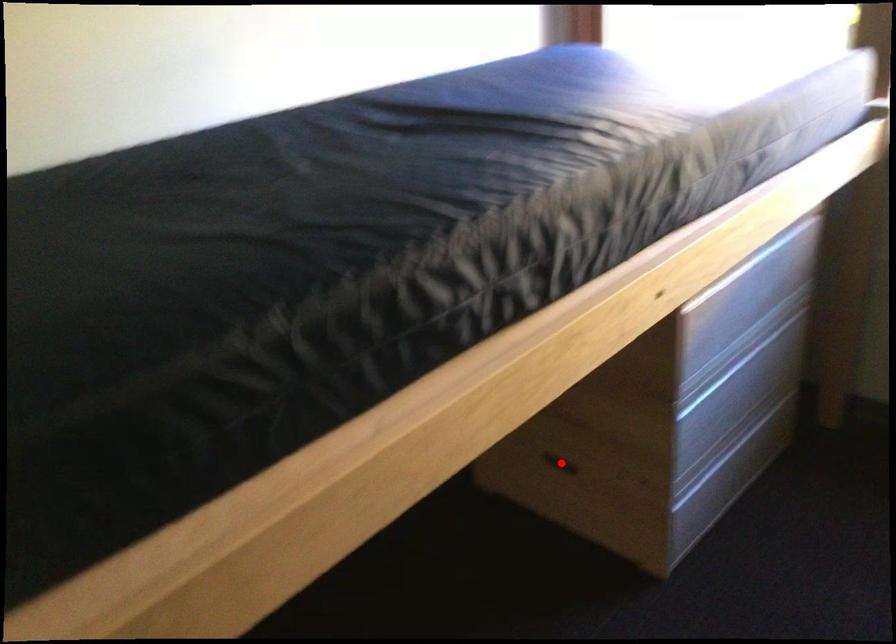
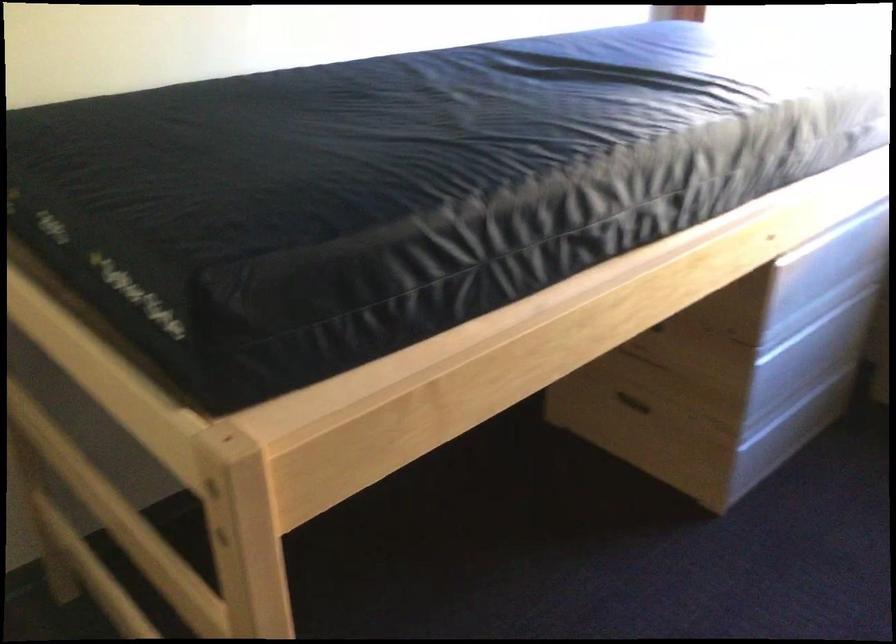
Find the pixel in the second image that matches the highlighted location in the first image.

(633, 402)